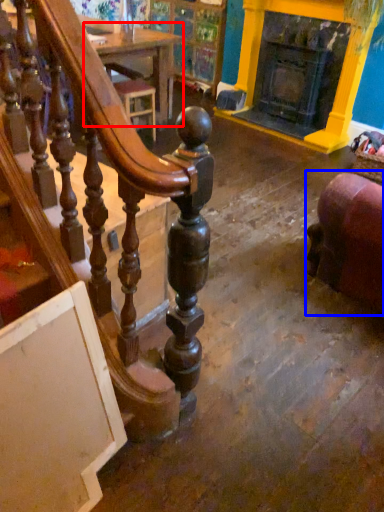
Question: Which point is further to the camera, table (highlighted by a red box) or furniture (highlighted by a blue box)?

Choices:
 (A) table
 (B) furniture

Answer: (A)